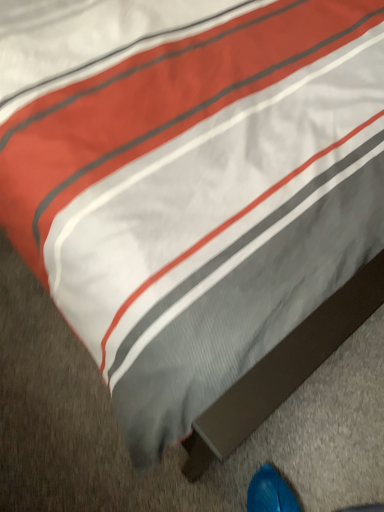
Describe the element at coordinates (233, 244) in the screenshot. I see `white fabric at center` at that location.

Where is `white fabric at center`? The width and height of the screenshot is (384, 512). white fabric at center is located at coordinates (233, 244).

This screenshot has width=384, height=512. I want to click on white fabric at center, so click(233, 244).